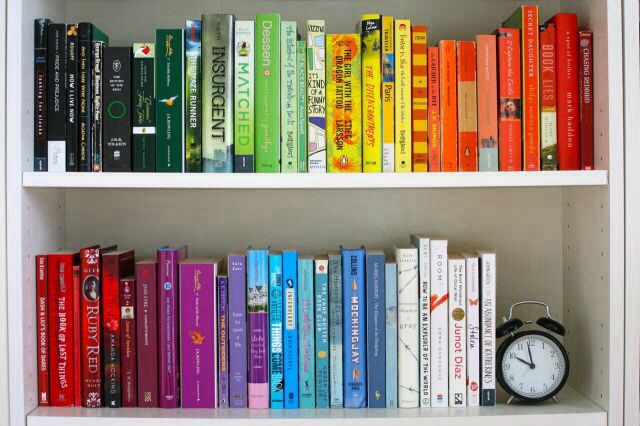
Identify the location of green books. (118, 116), (139, 107), (164, 100), (194, 106), (216, 76), (239, 92), (262, 97), (285, 109), (304, 100), (312, 74).